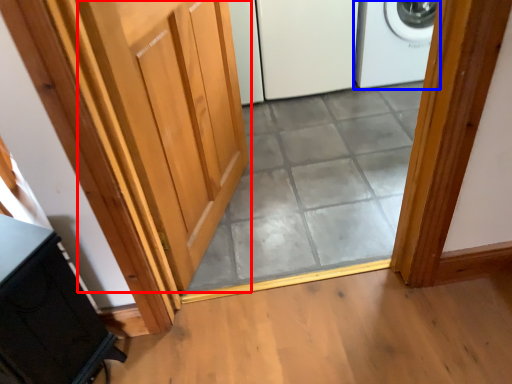
Question: Which object appears farthest to the camera in this image, door (highlighted by a red box) or home appliance (highlighted by a blue box)?

Choices:
 (A) door
 (B) home appliance

Answer: (B)